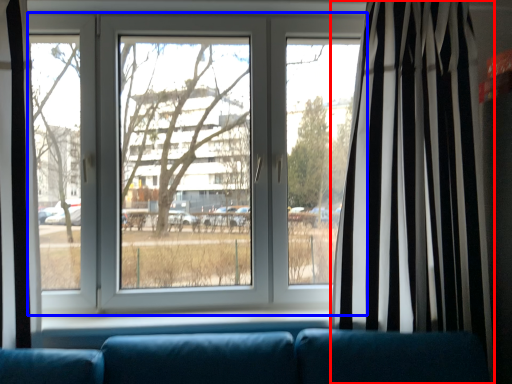
Question: Which of the following is the farthest to the observer, curtain (highlighted by a red box) or window (highlighted by a blue box)?

Choices:
 (A) curtain
 (B) window

Answer: (B)